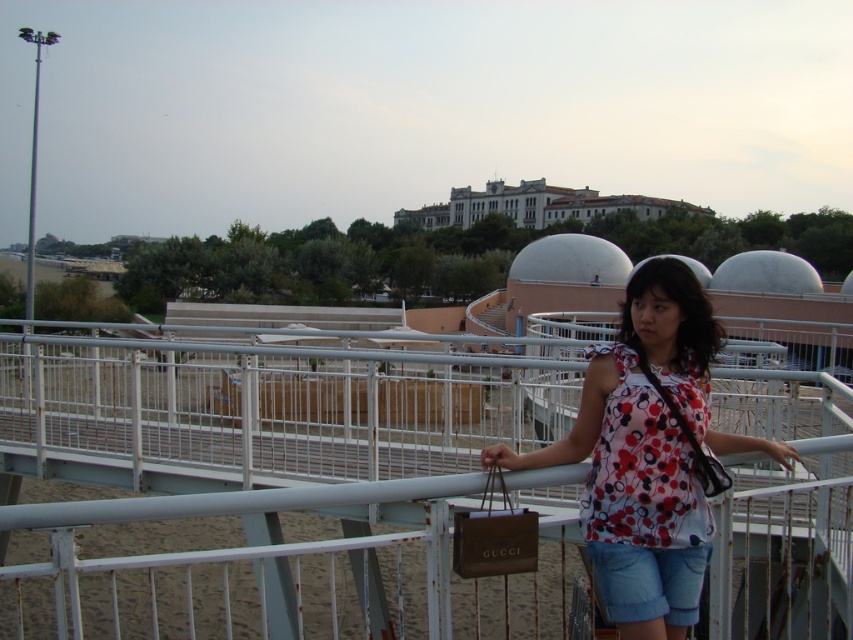
Question: Among these points, which one is nearest to the camera?

Choices:
 (A) (480, 516)
 (B) (200, 516)
 (C) (608, 548)
 (D) (590, 385)

Answer: (B)

Question: Can you confirm if white metal pedestrian bridge at center is positioned below denim shorts at lower center?

Choices:
 (A) yes
 (B) no

Answer: (A)

Question: Can you confirm if floral fabric blouse at center is positioned below denim shorts at lower center?

Choices:
 (A) no
 (B) yes

Answer: (A)

Question: Which object is closer to the camera taking this photo?

Choices:
 (A) floral fabric blouse at center
 (B) denim shorts at lower center
 (C) brown leather bag at lower center
 (D) white metal pedestrian bridge at center

Answer: (D)

Question: Which object is positioned farthest from the white metal pedestrian bridge at center?

Choices:
 (A) floral fabric blouse at center
 (B) brown leather bag at lower center
 (C) denim shorts at lower center

Answer: (C)

Question: Does white metal pedestrian bridge at center appear under floral fabric blouse at center?

Choices:
 (A) yes
 (B) no

Answer: (A)